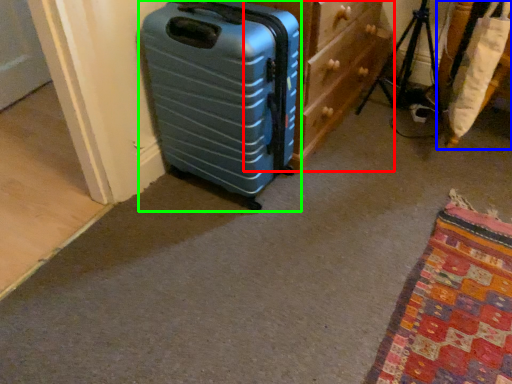
Question: Which object is the closest to the dresser (highlighted by a red box)? Choose among these: furniture (highlighted by a blue box) or suitcase (highlighted by a green box).

Choices:
 (A) furniture
 (B) suitcase

Answer: (B)